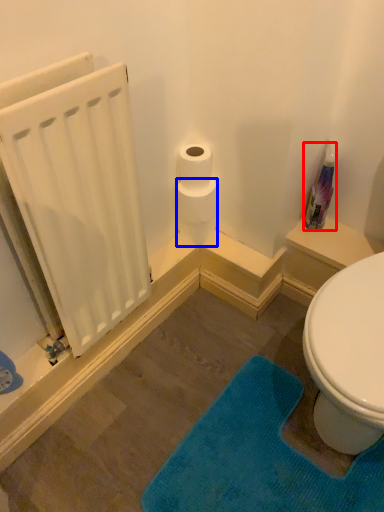
Question: Which object is closer to the camera taking this photo, cleaning product (highlighted by a red box) or toilet paper (highlighted by a blue box)?

Choices:
 (A) cleaning product
 (B) toilet paper

Answer: (A)